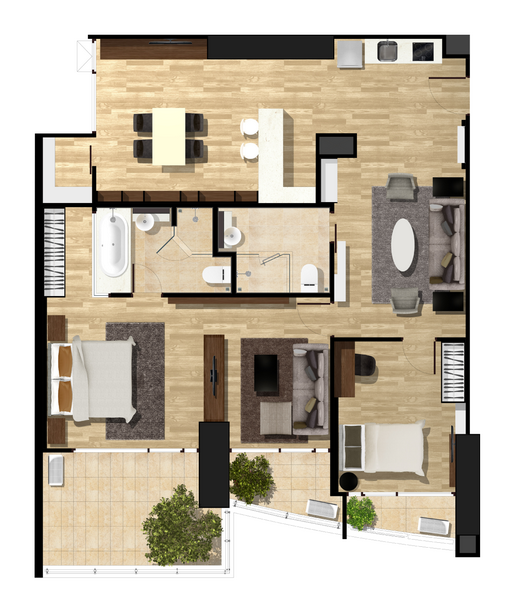
Find the location of a particular element. desk is located at coordinates (454, 381).